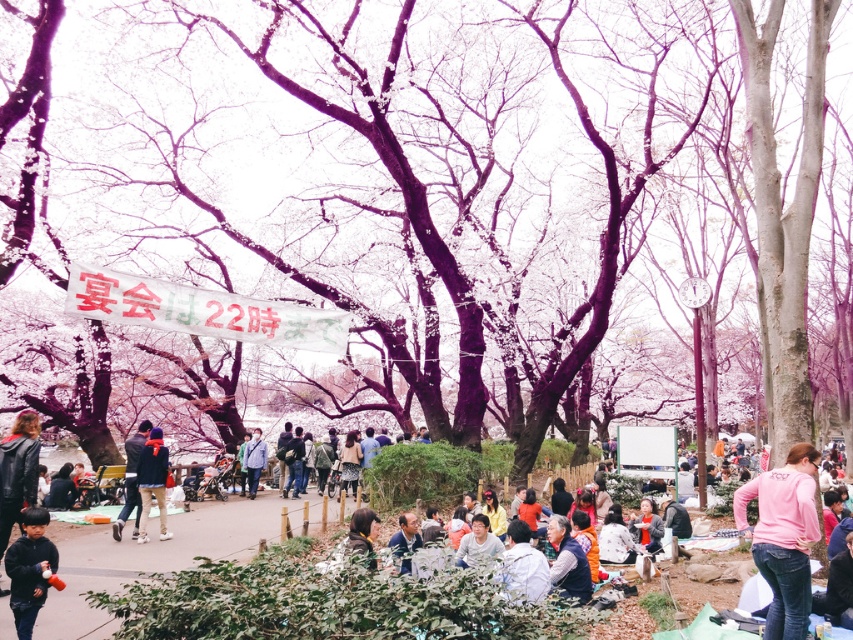
Does point (48, 557) come behind point (264, 458)?

No, (48, 557) is in front of (264, 458).

Looking at this image, measure the distance between point (55, 560) and camera.

Point (55, 560) is 52.79 feet away from camera.

Between point (38, 598) and point (263, 464), which one is positioned in front?

Positioned in front is point (38, 598).

You are a GUI agent. You are given a task and a screenshot of the screen. Output one action in this format:
    pyautogui.click(x=<x>, y=<y>)
    Task: Click on the black matte jacket at lower left
    This screenshot has width=853, height=640.
    Given the screenshot: What is the action you would take?
    pyautogui.click(x=28, y=570)

Does pink cotton shirt at lower right appear under matte gray jacket at center?

Incorrect, pink cotton shirt at lower right is not positioned below matte gray jacket at center.

Is pink cotton shirt at lower right shorter than matte gray jacket at center?

Incorrect, pink cotton shirt at lower right's height does not fall short of matte gray jacket at center's.

Is point (805, 627) farther from camera compared to point (556, 529)?

No, it is in front of (556, 529).

The height and width of the screenshot is (640, 853). What are the coordinates of `pink cotton shirt at lower right` in the screenshot? It's located at (782, 538).

Which is in front, point (161, 483) or point (260, 465)?

Positioned in front is point (161, 483).

Does dark blue jacket at center have a greater width compared to light blue fabric jacket at center?

Yes.

Measure the distance between point (141, 506) and camera.

They are 26.75 meters apart.

Image resolution: width=853 pixels, height=640 pixels. In order to click on dark blue jacket at center in this screenshot , I will do coord(152,481).